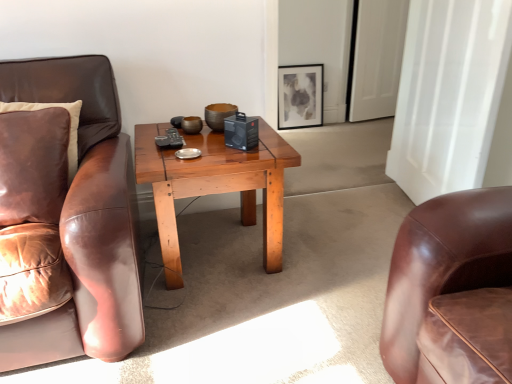
I want to click on vacant region below white glossy door at upper right (from a real-world perspective), so click(369, 123).